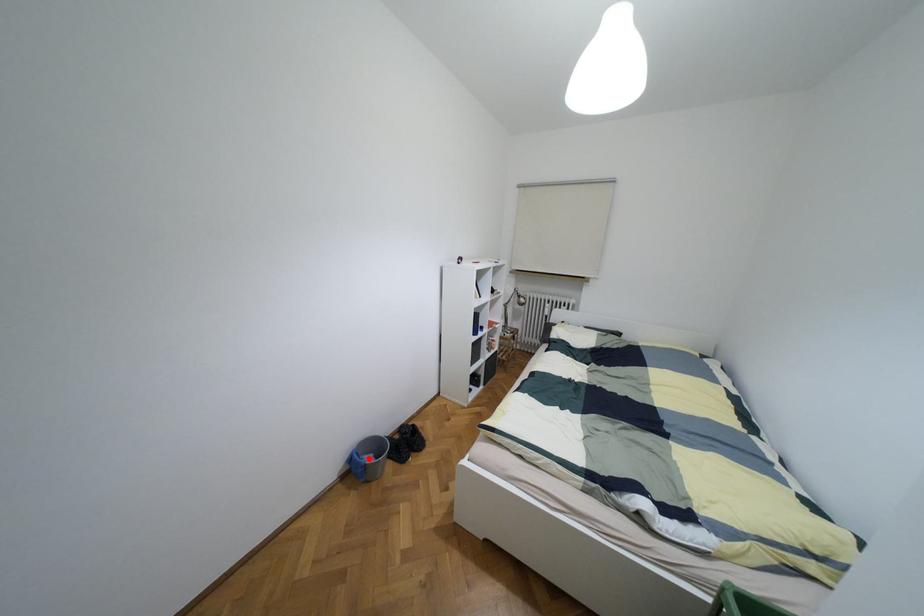
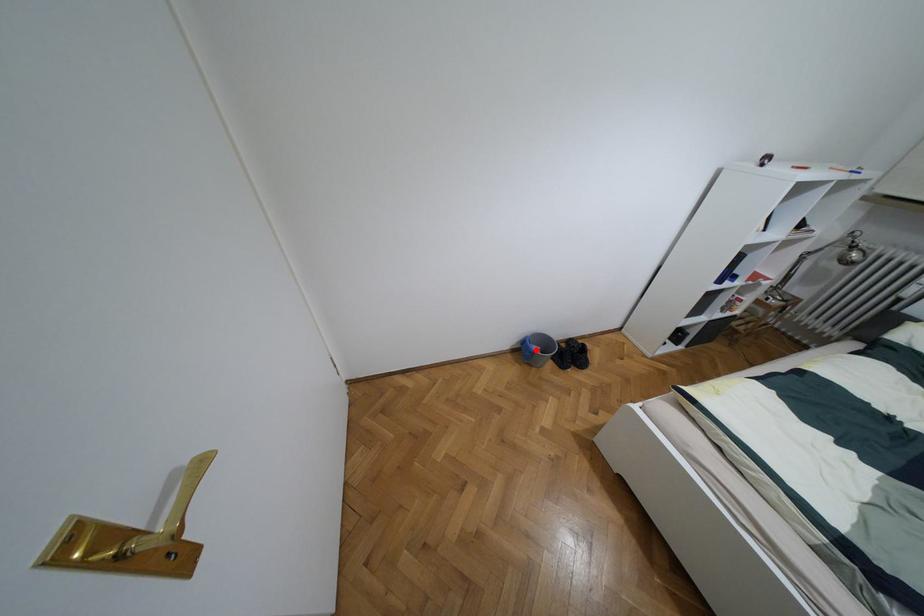
I am providing you with two images of the same scene from different viewpoints. A red point is marked on the first image and another point is marked on the second image. Do the highlighted points in image1 and image2 indicate the same real-world spot?

Yes